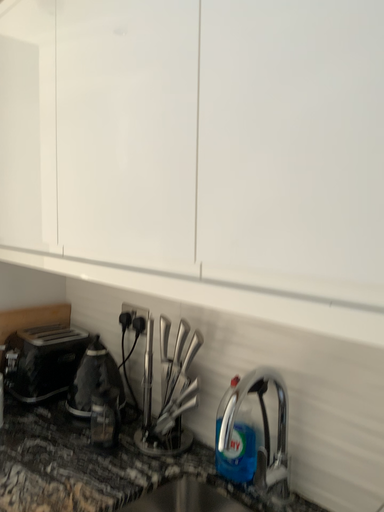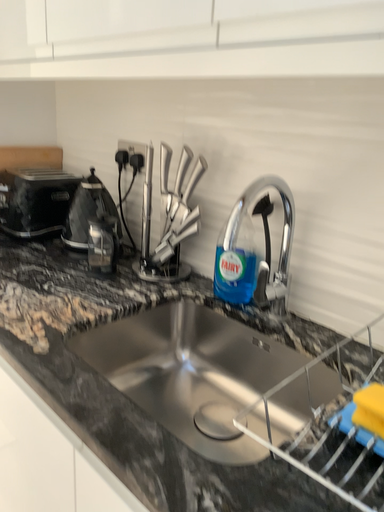
Question: How did the camera likely rotate when shooting the video?

Choices:
 (A) rotated upward
 (B) rotated downward

Answer: (B)